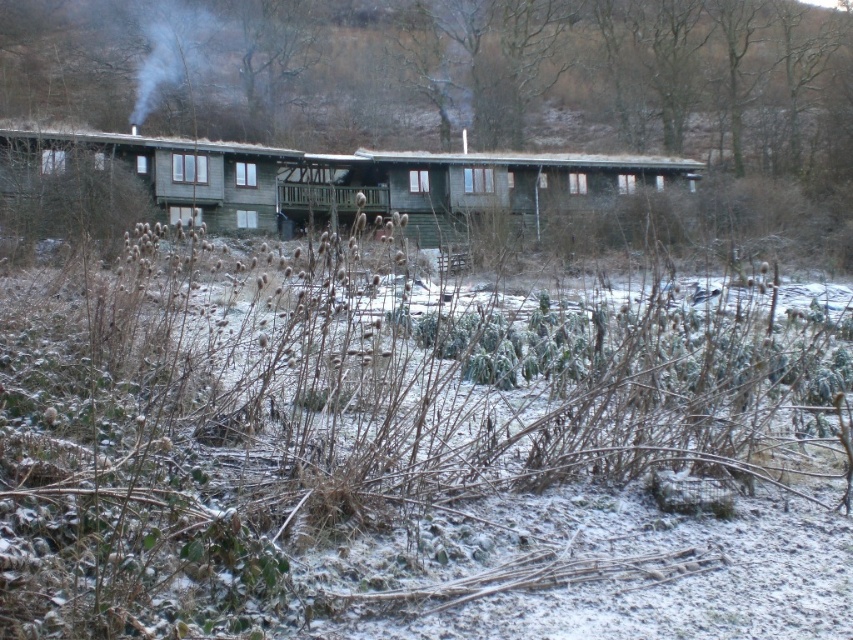
Does green wood cabin at center have a smaller size compared to green wooden hut at left?

No, green wood cabin at center is not smaller than green wooden hut at left.

Between green wood cabin at center and green wooden hut at left, which one appears on the right side from the viewer's perspective?

Result: From the viewer's perspective, green wood cabin at center appears more on the right side.

Does point (201, 188) come farther from viewer compared to point (160, 200)?

Yes, point (201, 188) is behind point (160, 200).

The height and width of the screenshot is (640, 853). I want to click on green wood cabin at center, so click(340, 179).